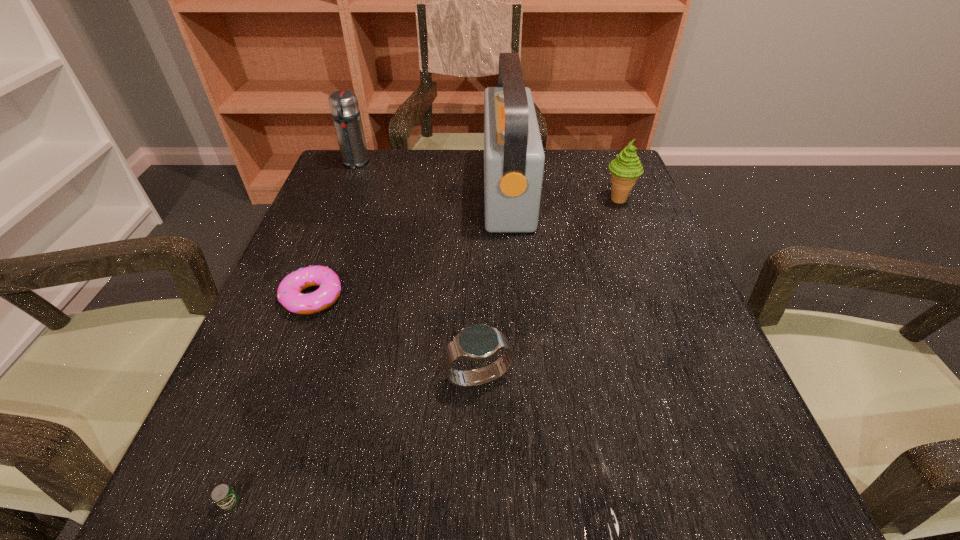
Image resolution: width=960 pixels, height=540 pixels. Find the location of `vacant space that is in between the radio receiver and the watch`. vacant space that is in between the radio receiver and the watch is located at coordinates (493, 284).

Find the location of `blank region between the radio receiver and the thermos bottle`. blank region between the radio receiver and the thermos bottle is located at coordinates (431, 177).

Where is `unoccupied area between the fourth shortest object and the second shortest object`? The height and width of the screenshot is (540, 960). unoccupied area between the fourth shortest object and the second shortest object is located at coordinates (466, 248).

The image size is (960, 540). What are the coordinates of `free space between the thermos bottle and the second shortest object` in the screenshot? It's located at pos(334,230).

What are the coordinates of `free space between the third shortest object and the doughnut` in the screenshot? It's located at [396, 337].

What are the coordinates of `vacant region between the third nearest object and the third shortest object` in the screenshot? It's located at tap(396, 337).

Find the location of `object that is the closest to the second shortest object`. object that is the closest to the second shortest object is located at coordinates (479, 342).

The width and height of the screenshot is (960, 540). Find the location of `object that is the second nearest to the fifth farthest object`. object that is the second nearest to the fifth farthest object is located at coordinates 222,495.

Where is `vacant area that satisfies the following two spatial constraints: 1. with a handle on the side of the thermos bottle; 2. on the left side of the fifth farthest object`? vacant area that satisfies the following two spatial constraints: 1. with a handle on the side of the thermos bottle; 2. on the left side of the fifth farthest object is located at coordinates (270, 377).

Identify the location of vacant space that satisfies the following two spatial constraints: 1. with a handle on the side of the second shortest object; 2. on the left side of the thermos bottle. This screenshot has width=960, height=540. (302, 297).